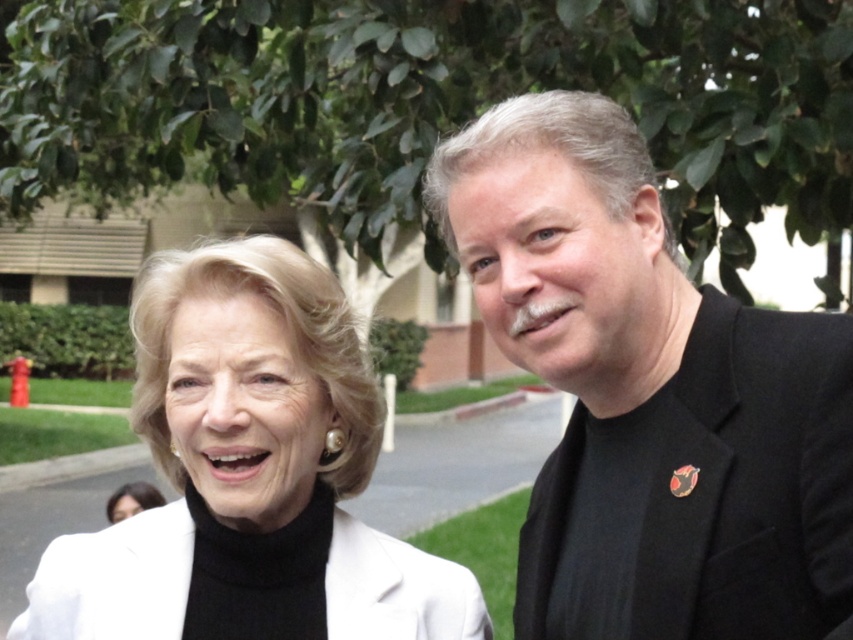
Does black matte suit at right appear on the left side of white matte blazer at lower left?

Incorrect, black matte suit at right is not on the left side of white matte blazer at lower left.

Can you confirm if black matte suit at right is positioned below white matte blazer at lower left?

No, black matte suit at right is not below white matte blazer at lower left.

Locate an element on the screen. This screenshot has width=853, height=640. black matte suit at right is located at coordinates (648, 396).

Does black matte suit at right have a larger size compared to white matte jacket at upper left?

Indeed, black matte suit at right has a larger size compared to white matte jacket at upper left.

What do you see at coordinates (648, 396) in the screenshot?
I see `black matte suit at right` at bounding box center [648, 396].

What do you see at coordinates (648, 396) in the screenshot?
I see `black matte suit at right` at bounding box center [648, 396].

The width and height of the screenshot is (853, 640). I want to click on black matte suit at right, so click(648, 396).

Does white matte jacket at upper left appear on the left side of white matte blazer at lower left?

Incorrect, white matte jacket at upper left is not on the left side of white matte blazer at lower left.

Is white matte jacket at upper left above white matte blazer at lower left?

Yes.

This screenshot has height=640, width=853. Describe the element at coordinates (248, 474) in the screenshot. I see `white matte jacket at upper left` at that location.

This screenshot has height=640, width=853. Identify the location of white matte jacket at upper left. click(x=248, y=474).